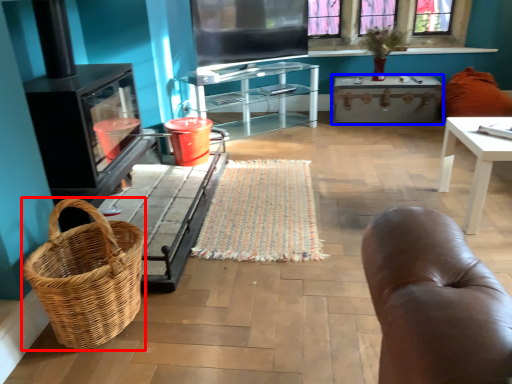
Question: Which of the following is the closest to the observer, picnic basket (highlighted by a red box) or table (highlighted by a blue box)?

Choices:
 (A) picnic basket
 (B) table

Answer: (A)